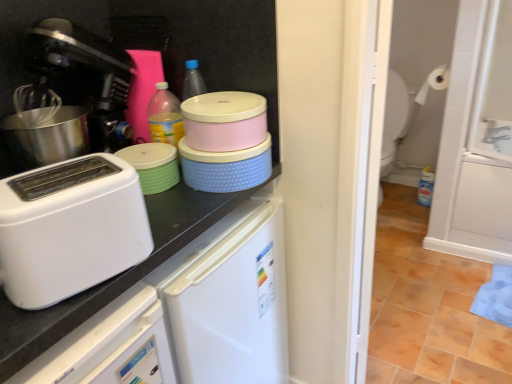
The height and width of the screenshot is (384, 512). What are the coordinates of `unoccupied space behind blue glossy bottle at lower right` in the screenshot? It's located at (403, 192).